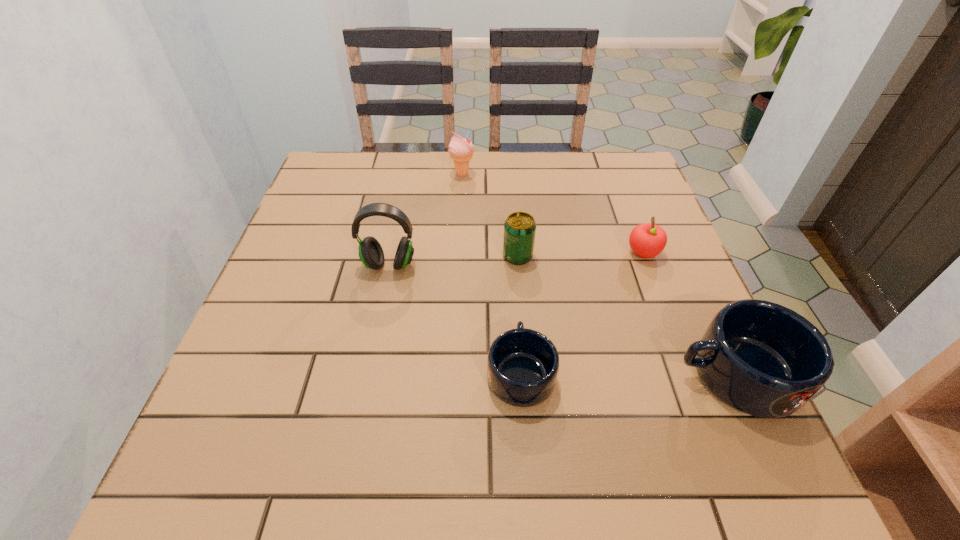
Locate an element on the screen. This screenshot has width=960, height=540. the shorter mug is located at coordinates (522, 367).

Where is `the shortest object`? The image size is (960, 540). the shortest object is located at coordinates (522, 367).

This screenshot has width=960, height=540. What are the coordinates of `the taller mug` in the screenshot? It's located at (763, 359).

In order to click on the second object from left to right in this screenshot , I will do `click(461, 150)`.

I want to click on icecream, so click(x=461, y=150).

Find the location of `beer can`. beer can is located at coordinates (519, 228).

Image resolution: width=960 pixels, height=540 pixels. I want to click on apple, so click(x=647, y=240).

The width and height of the screenshot is (960, 540). Identify the location of the tallest object. (371, 254).

Locate an element on the screen. headset is located at coordinates (371, 254).

This screenshot has height=540, width=960. I want to click on vacant space located 0.130m with the handle on the side of the left mug, so click(x=515, y=290).